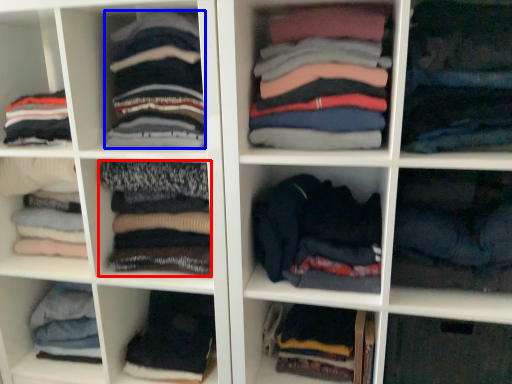
Question: Which point is further to the camera, clothing (highlighted by a red box) or clothing (highlighted by a blue box)?

Choices:
 (A) clothing
 (B) clothing

Answer: (A)